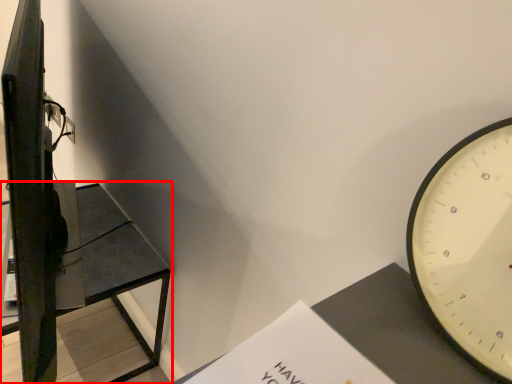
Question: From the image's perspective, what is the correct spatial relationship of furniture (annotated by the red box) in relation to paperback book?

Choices:
 (A) above
 (B) below

Answer: (B)